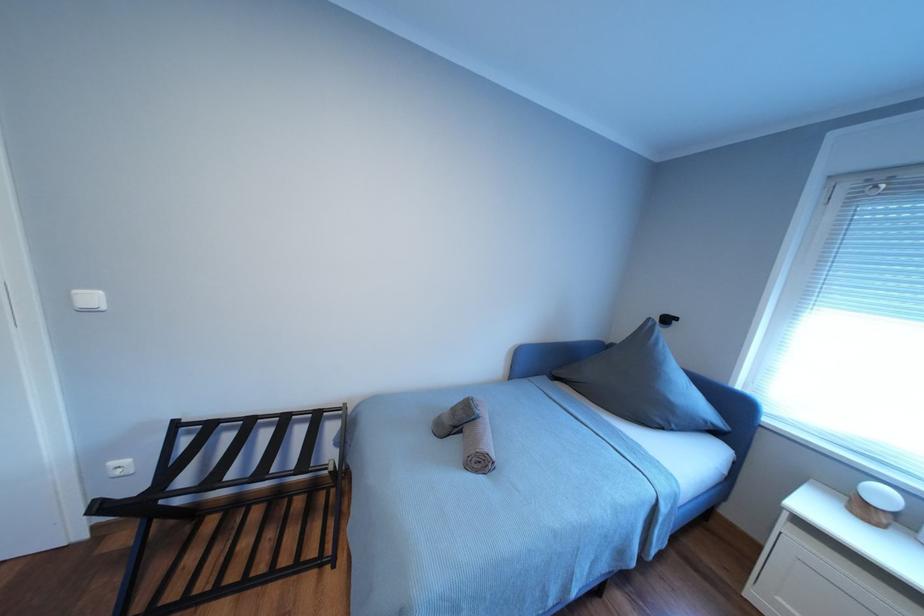
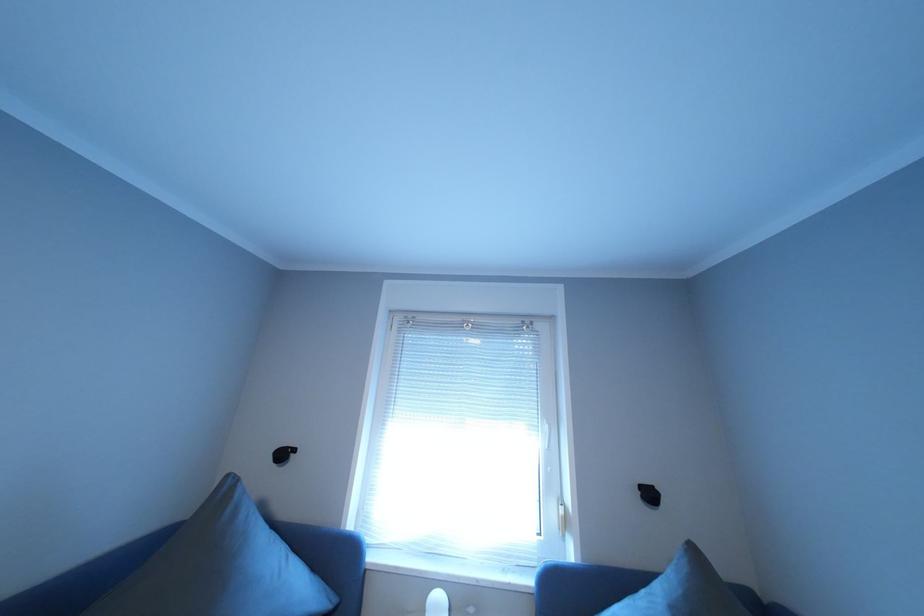
The images are taken continuously from a first-person perspective. In which direction is your viewpoint rotating?

The rotation direction of the camera is right-up.